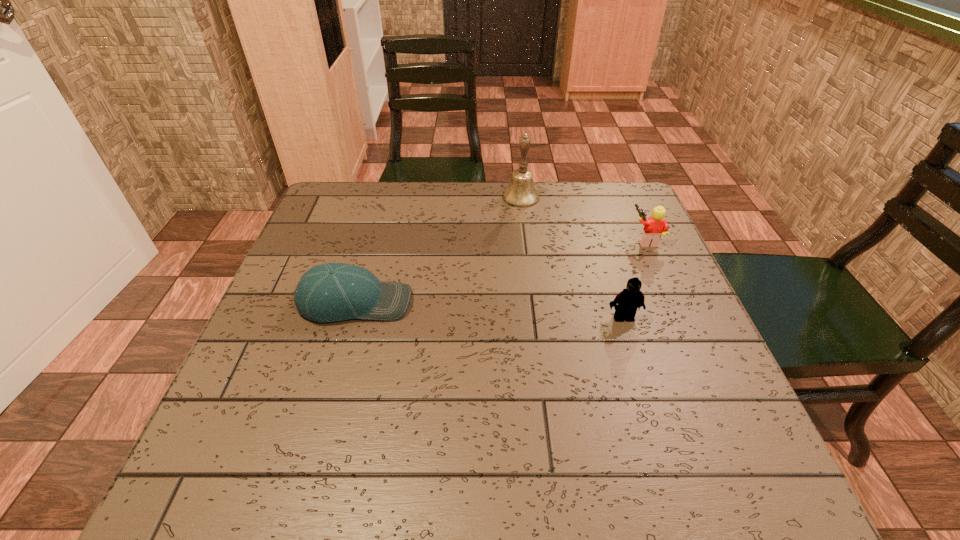
You are a GUI agent. You are given a task and a screenshot of the screen. Output one action in this format:
    pyautogui.click(x=<x>, y=<y>)
    Task: Click on the second object from left to right
    Image resolution: width=960 pixels, height=540 pixels.
    Given the screenshot: What is the action you would take?
    pyautogui.click(x=521, y=192)

You are a GUI agent. You are given a task and a screenshot of the screen. Output one action in this format:
    pyautogui.click(x=<x>, y=<y>)
    Task: Click on the bell
    The image size is (960, 540).
    Given the screenshot: What is the action you would take?
    pyautogui.click(x=521, y=192)

This screenshot has width=960, height=540. Identify the location of the rightmost object. (655, 226).

In order to click on the right Lego in this screenshot , I will do `click(655, 226)`.

Where is `the second object from right to left`? This screenshot has height=540, width=960. the second object from right to left is located at coordinates (628, 300).

This screenshot has width=960, height=540. I want to click on the left Lego, so click(628, 300).

This screenshot has width=960, height=540. Find the location of `the leftmost object`. the leftmost object is located at coordinates pos(330,292).

Where is `the shortest object`? Image resolution: width=960 pixels, height=540 pixels. the shortest object is located at coordinates (330, 292).

This screenshot has height=540, width=960. Identify the location of free space located on the right of the bell. (635, 197).

Where is `vacant space located in front of the rightmost object with the accessory visible`? vacant space located in front of the rightmost object with the accessory visible is located at coordinates (534, 239).